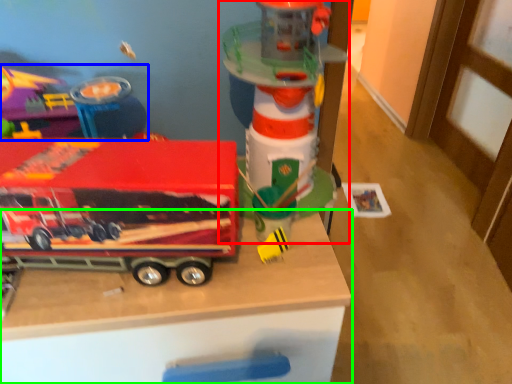
Question: Considering the real-world distances, which object is farthest from toy (highlighted by a red box)? toy (highlighted by a blue box) or table (highlighted by a green box)?

Choices:
 (A) toy
 (B) table

Answer: (A)